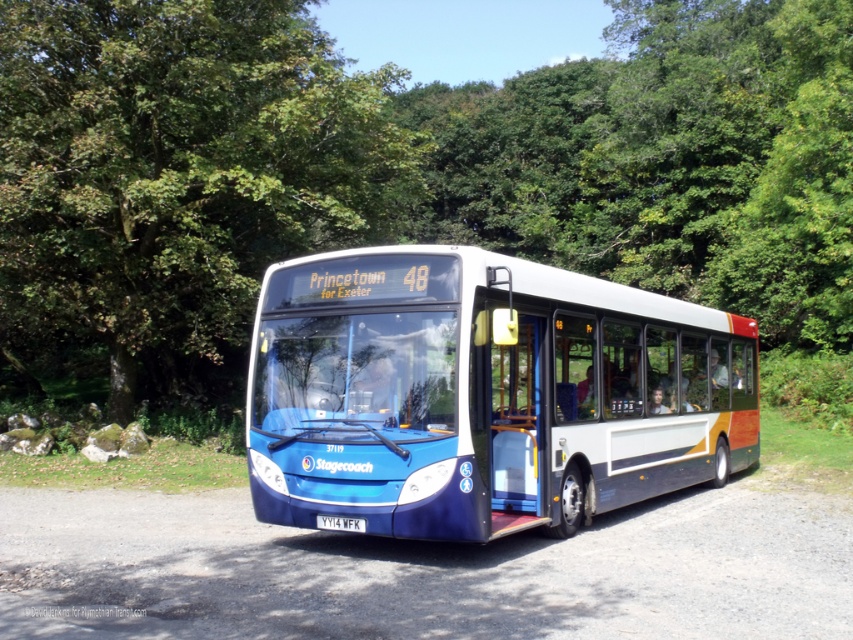
Is point (105, 337) in front of point (360, 516)?

No, it is behind (360, 516).

Is green leafy tree at center wider than blue metallic bus at center?

Correct, the width of green leafy tree at center exceeds that of blue metallic bus at center.

Is point (196, 192) positioned in front of point (631, 474)?

No, (196, 192) is further to viewer.

The width and height of the screenshot is (853, 640). Find the location of `green leafy tree at center`. green leafy tree at center is located at coordinates (173, 180).